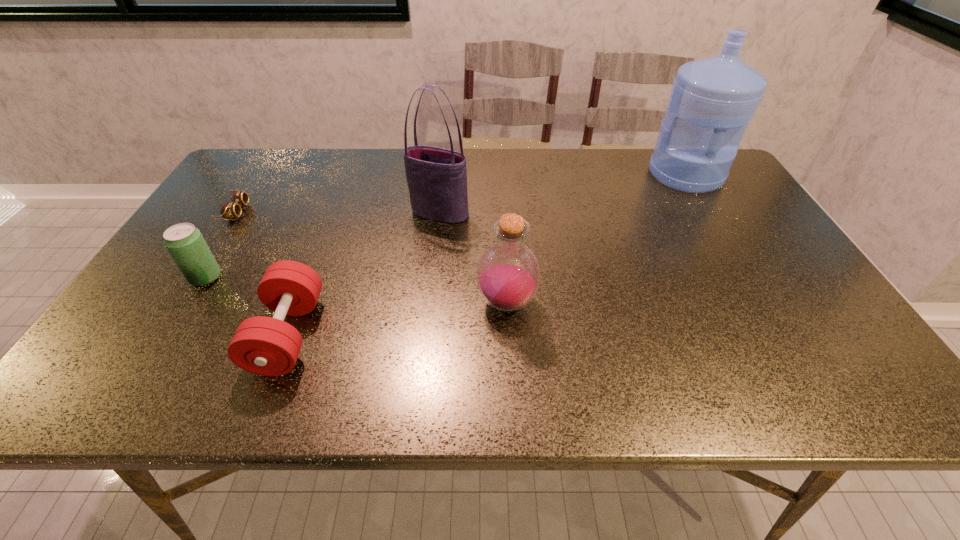
Where is `object at the right edge`? This screenshot has height=540, width=960. object at the right edge is located at coordinates (713, 99).

This screenshot has height=540, width=960. Find the location of `object situated at the far right corner`. object situated at the far right corner is located at coordinates (713, 99).

The height and width of the screenshot is (540, 960). What are the coordinates of `free space at the far edge of the desktop` in the screenshot? It's located at (639, 152).

I want to click on vacant space at the near edge, so click(700, 396).

Identify the location of free space at the left edge. The image size is (960, 540). (208, 219).

Find the location of a particular element. This screenshot has width=960, height=540. free point at the right edge is located at coordinates (771, 325).

Identify the location of vacant space at the far left corner. This screenshot has width=960, height=540. (241, 172).

This screenshot has height=540, width=960. I want to click on vacant space that is in between the water jug and the soda, so click(x=445, y=226).

This screenshot has width=960, height=540. Identify the location of empty space between the shortest object and the third tallest object. [x=372, y=258].

Where is `free space between the bottle and the dumbbell`? The image size is (960, 540). free space between the bottle and the dumbbell is located at coordinates (397, 319).